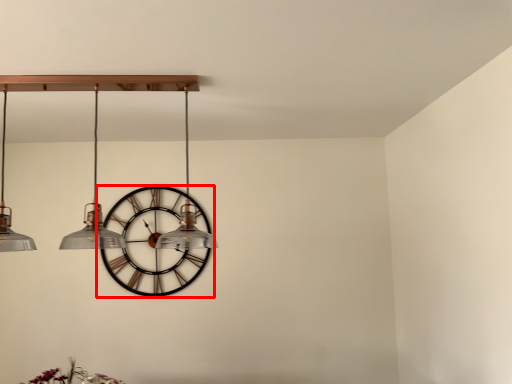
Question: From the image's perspective, where is wall clock (annotated by the red box) located in relation to chandelier in the image?

Choices:
 (A) above
 (B) below

Answer: (B)